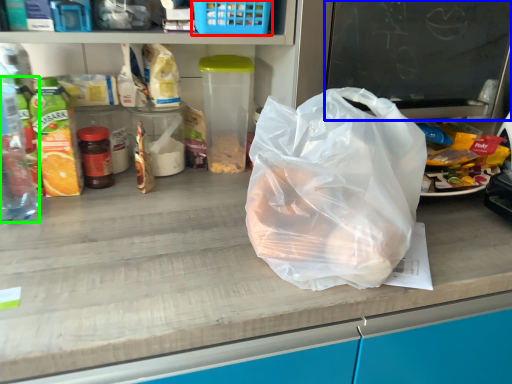
Question: Which object is positioned farthest from basket (highlighted by a red box)? Select from writing (highlighted by a blue box) and bottle (highlighted by a green box).

Choices:
 (A) writing
 (B) bottle

Answer: (B)